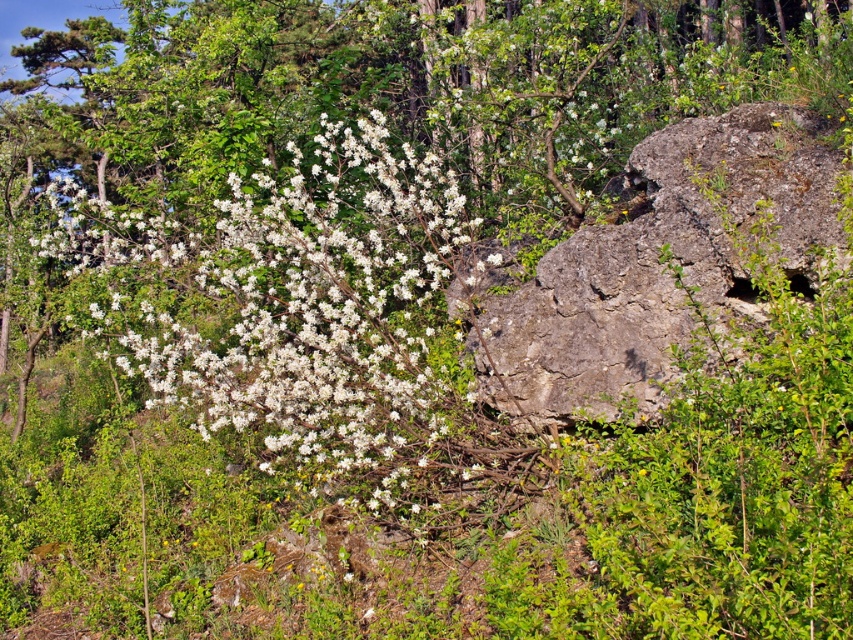
You are planning to place a small decorative statue in this outdoor scene. The statue is 1 meter wide. You want to place it either next to the white matte flowers at center or near the gray rough rock at right. Based on the scene description, which location would allow the statue to fit without overcrowding the area?

The gray rough rock at right has a greater width than the white matte flowers at center. Therefore, placing the 1 meter wide statue near the gray rough rock at right would provide more space and prevent overcrowding.

You are a gardener planning to plant a new tree that requires at least 2 meters of clearance above it. You notice the white matte flowers at center and the gray rough rock at right in the scene. Based on their heights, which object would allow enough vertical space for the tree?

Result: The gray rough rock at right is taller than the white matte flowers at center. Since the tree needs 2 meters of clearance, you should check the height of the gray rough rock at right to ensure it provides sufficient vertical space.